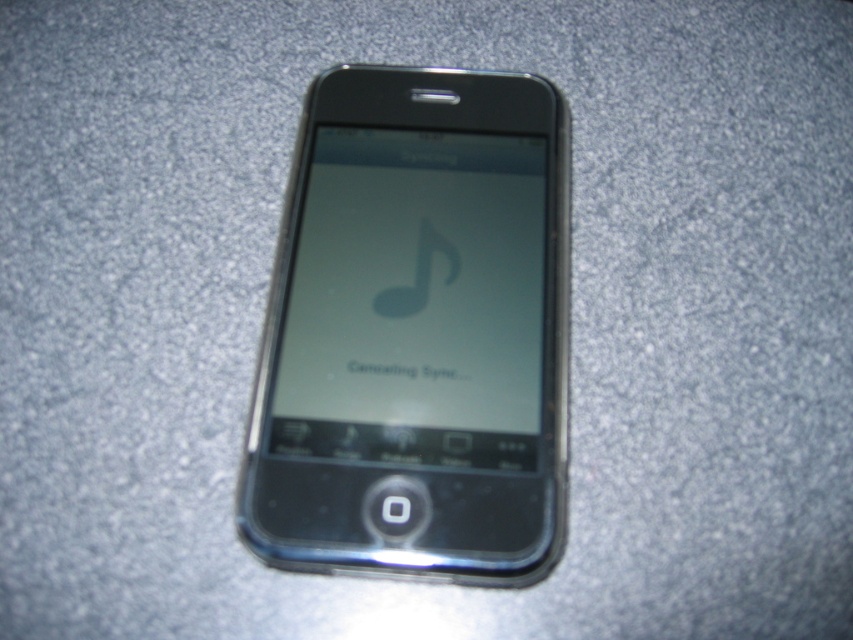
Question: From the image, what is the correct spatial relationship of black glossy smartphone at center in relation to matte glass screen at center?

Choices:
 (A) left
 (B) right

Answer: (B)

Question: Can you confirm if black glossy smartphone at center is positioned to the left of matte glass screen at center?

Choices:
 (A) no
 (B) yes

Answer: (A)

Question: Can you confirm if black glossy smartphone at center is bigger than matte glass screen at center?

Choices:
 (A) no
 (B) yes

Answer: (B)

Question: Which object appears farthest from the camera in this image?

Choices:
 (A) black glossy smartphone at center
 (B) matte glass screen at center

Answer: (B)

Question: Which point is farther to the camera?

Choices:
 (A) black glossy smartphone at center
 (B) matte glass screen at center

Answer: (B)